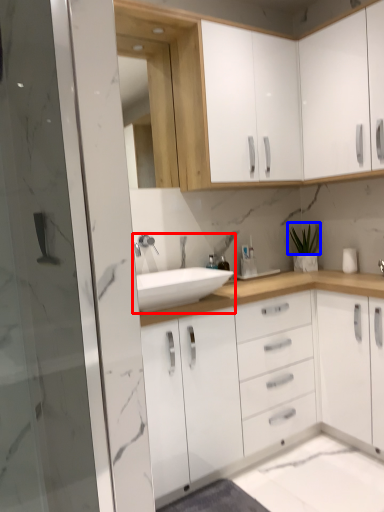
Question: Which object is further to the camera taking this photo, sink (highlighted by a red box) or plant (highlighted by a blue box)?

Choices:
 (A) sink
 (B) plant

Answer: (B)